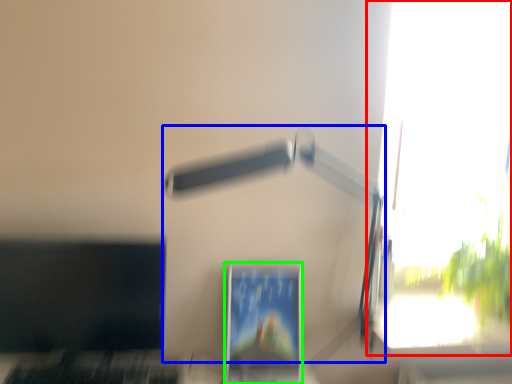
Question: Estimate the real-world distances between objects in this image. Which object is closer to window (highlighted by a red box), lamp (highlighted by a blue box) or computer monitor (highlighted by a green box)?

Choices:
 (A) lamp
 (B) computer monitor

Answer: (A)